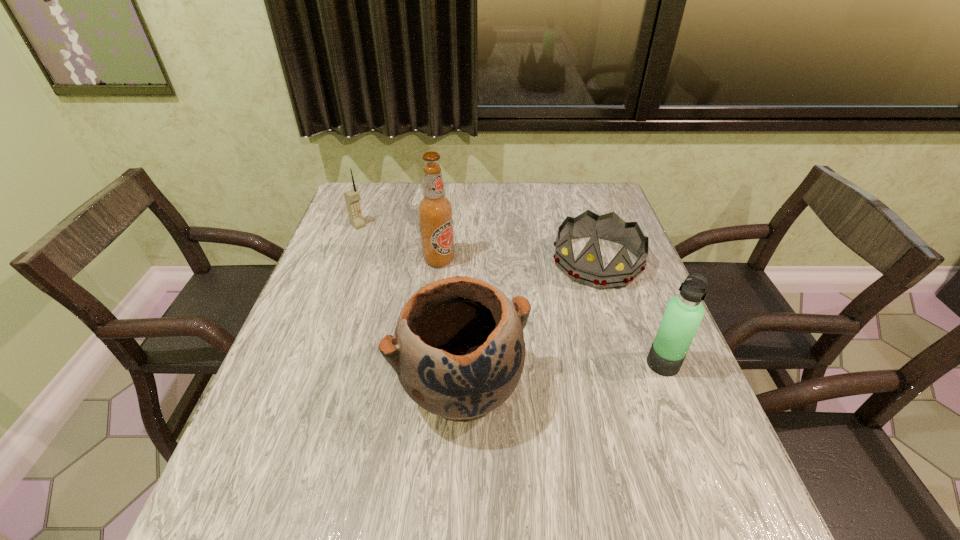
I want to click on free space in the image that satisfies the following two spatial constraints: 1. on the front side of the beer bottle; 2. on the left side of the tiara, so click(439, 261).

In order to click on vacant space that satisfies the following two spatial constraints: 1. on the front side of the cellular telephone; 2. on the right side of the beer bottle in this screenshot , I will do coord(346,260).

At what (x,y) coordinates should I click in order to perform the action: click on vacant point that satisfies the following two spatial constraints: 1. on the back side of the thermos bottle; 2. on the left side of the pottery. Please return your answer as a coordinate pair (x, y). Looking at the image, I should click on (462, 363).

The height and width of the screenshot is (540, 960). In order to click on free point that satisfies the following two spatial constraints: 1. on the front side of the pottery; 2. on the right side of the beer bottle in this screenshot , I will do `click(425, 387)`.